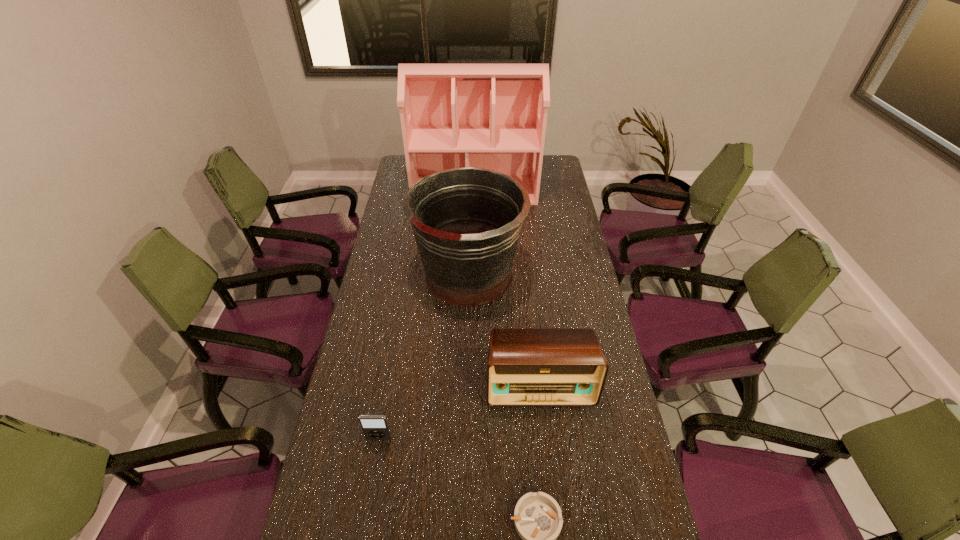
Image resolution: width=960 pixels, height=540 pixels. In order to click on vacant area located 0.310m on the front-facing side of the radio receiver in this screenshot , I will do `click(556, 526)`.

Identify the location of free space located on the front-facing side of the fourth farthest object. (370, 490).

Locate an element on the screen. This screenshot has height=540, width=960. object positioned at the far edge is located at coordinates (493, 116).

I want to click on dollhouse located at the left edge, so click(x=493, y=116).

In order to click on bucket located at the left edge in this screenshot , I will do `click(467, 221)`.

This screenshot has height=540, width=960. Find the location of `iPod located in the left edge section of the desktop`. iPod located in the left edge section of the desktop is located at coordinates (375, 427).

This screenshot has width=960, height=540. In order to click on dollhouse that is positioned at the right edge in this screenshot , I will do `click(493, 116)`.

At what (x,y) coordinates should I click in order to perform the action: click on radio receiver located at the right edge. Please return your answer as a coordinate pair (x, y). The width and height of the screenshot is (960, 540). Looking at the image, I should click on (526, 367).

Find the location of a particular element. The image size is (960, 540). object that is at the far left corner is located at coordinates (493, 116).

At what (x,y) coordinates should I click in order to perform the action: click on object at the far right corner. Please return your answer as a coordinate pair (x, y). Looking at the image, I should click on (493, 116).